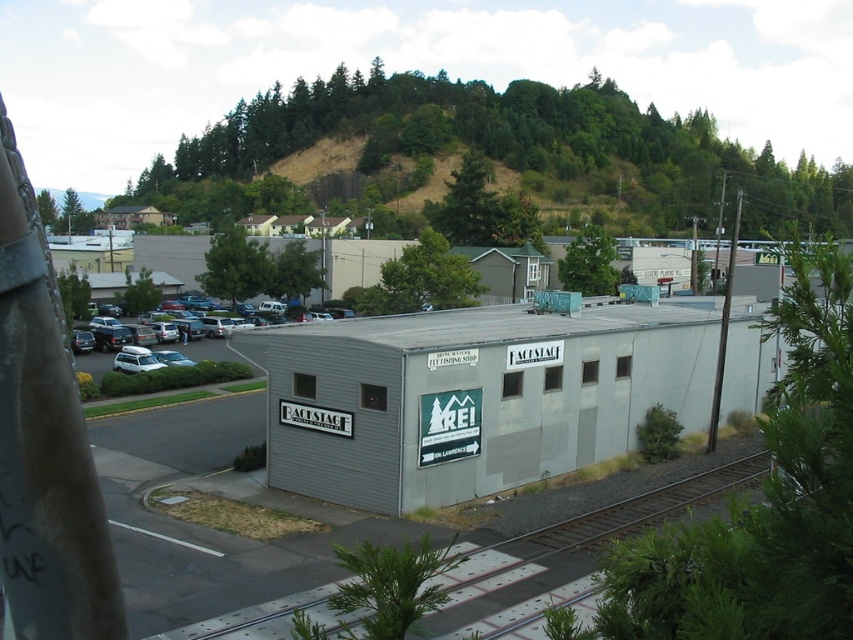
Question: Is the position of smooth asphalt road at lower left less distant than that of white matte suv at center?

Choices:
 (A) no
 (B) yes

Answer: (B)

Question: Which object is farther from the camera taking this photo?

Choices:
 (A) smooth asphalt road at lower left
 (B) white matte suv at center
 (C) gray matte building at center

Answer: (B)

Question: Which point appears closest to the camera in this image?

Choices:
 (A) (320, 605)
 (B) (248, 340)

Answer: (A)

Question: Is smooth asphalt road at lower left further to camera compared to white matte suv at center?

Choices:
 (A) no
 (B) yes

Answer: (A)

Question: Which point is closer to the camera taking this photo?

Choices:
 (A) (216, 342)
 (B) (471, 545)
 (C) (310, 394)

Answer: (B)

Question: Can you confirm if gray matte building at center is positioned above smooth asphalt road at lower left?

Choices:
 (A) no
 (B) yes

Answer: (B)